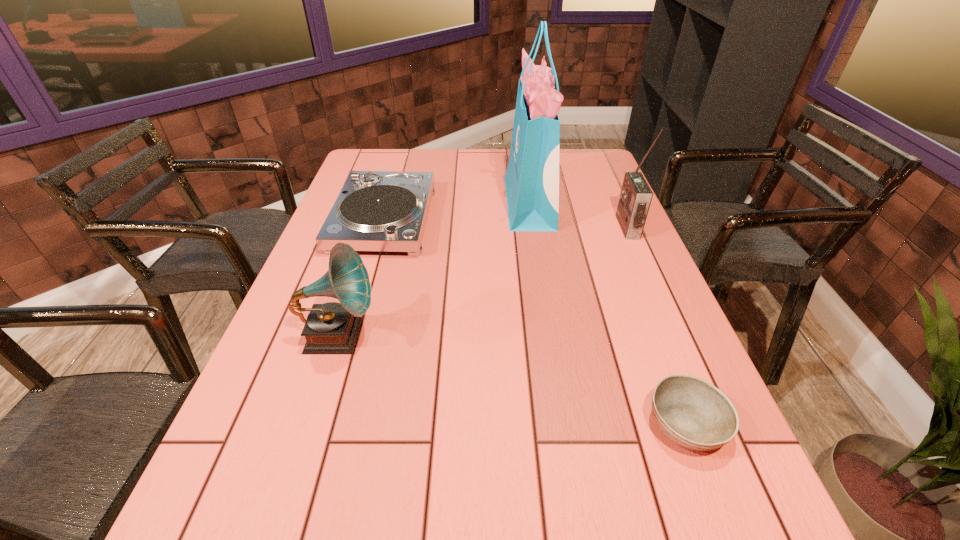
Locate an element on the screen. This screenshot has height=540, width=960. vacant area located on the display of the fourth shortest object is located at coordinates (526, 227).

Identify the location of vacant space located 0.380m on the display of the fourth shortest object. This screenshot has width=960, height=540. (x=493, y=227).

Where is `vacant space located 0.340m from the horn of the phonograph_record`? This screenshot has height=540, width=960. vacant space located 0.340m from the horn of the phonograph_record is located at coordinates (527, 336).

Locate an element on the screen. This screenshot has width=960, height=540. free space located 0.280m on the right of the record player is located at coordinates (522, 219).

Find the location of a particular element. The image size is (960, 540). vacant space located 0.180m on the back of the bowl is located at coordinates (648, 326).

The width and height of the screenshot is (960, 540). I want to click on object situated at the far edge, so click(532, 178).

At what (x,y) coordinates should I click in order to perform the action: click on phonograph_record that is at the left edge. Please return your answer as a coordinate pair (x, y). The width and height of the screenshot is (960, 540). Looking at the image, I should click on (331, 328).

At what (x,y) coordinates should I click in order to perform the action: click on record player located in the left edge section of the desktop. Please return your answer as a coordinate pair (x, y). The height and width of the screenshot is (540, 960). Looking at the image, I should click on (376, 210).

This screenshot has width=960, height=540. Identify the location of radio receiver that is at the right edge. (635, 198).

The height and width of the screenshot is (540, 960). I want to click on bowl that is positioned at the right edge, so click(693, 413).